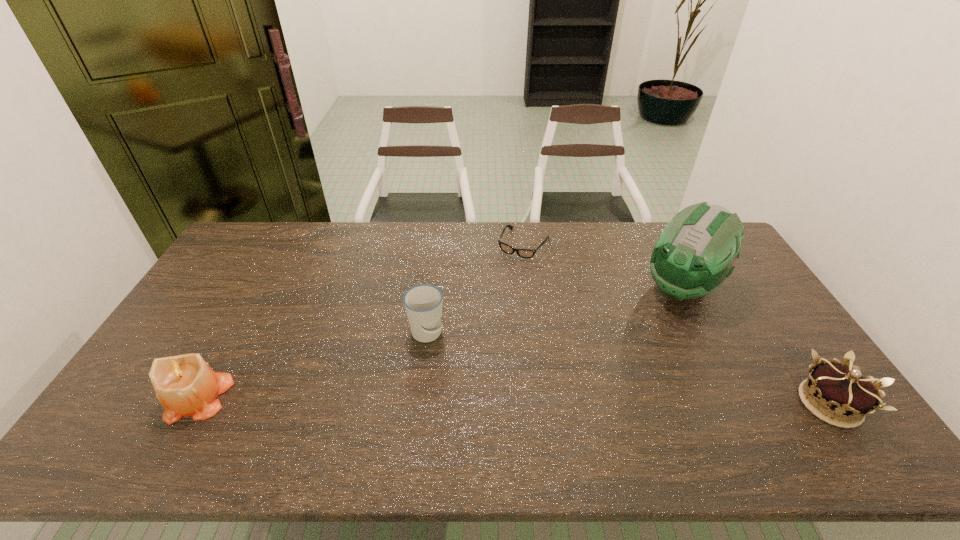
Identify the location of candle that is at the near edge. The height and width of the screenshot is (540, 960). (185, 385).

Image resolution: width=960 pixels, height=540 pixels. I want to click on crown that is positioned at the near edge, so click(843, 397).

Where is `object located at the left edge`? The height and width of the screenshot is (540, 960). object located at the left edge is located at coordinates (185, 385).

The height and width of the screenshot is (540, 960). In order to click on crown present at the right edge in this screenshot , I will do `click(843, 397)`.

You are a GUI agent. You are given a task and a screenshot of the screen. Output one action in this format:
    pyautogui.click(x=<x>, y=<y>)
    Task: Click on the football helmet at the right edge
    
    Given the screenshot: What is the action you would take?
    pyautogui.click(x=695, y=253)

Where is `object located at the near left corner`? object located at the near left corner is located at coordinates (185, 385).

Where is `object that is at the far right corner`? object that is at the far right corner is located at coordinates (695, 253).

At what (x,y) coordinates should I click in order to perform the action: click on object that is at the near right corner. Please return your answer as a coordinate pair (x, y). The width and height of the screenshot is (960, 540). Looking at the image, I should click on (843, 397).

The image size is (960, 540). I want to click on free space at the far edge of the desktop, so click(646, 247).

At what (x,y) coordinates should I click in order to perform the action: click on vacant region at the near edge of the desktop. Please return your answer as a coordinate pair (x, y). The height and width of the screenshot is (540, 960). Looking at the image, I should click on (678, 391).